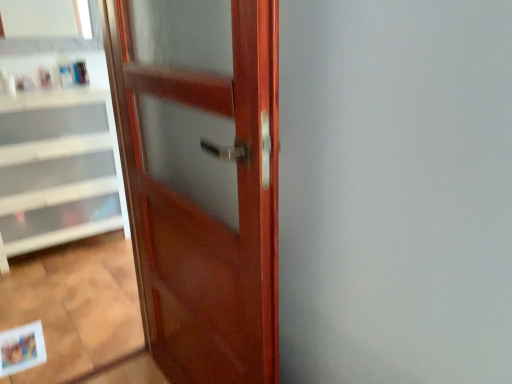
This screenshot has width=512, height=384. In order to click on free space in front of matte plastic bottle at upper left, positioned as the third toiletry in left-to-right order in this screenshot , I will do `click(67, 86)`.